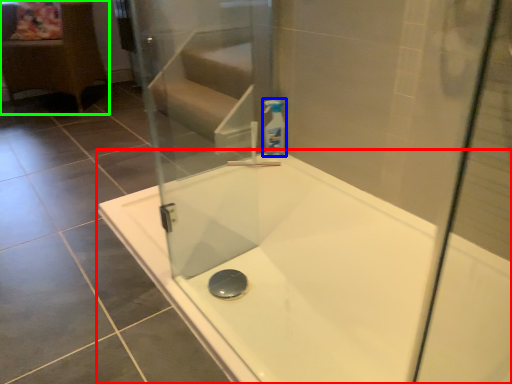
Question: Which is nearer to the bathtub (highlighted by a red box)? cleaning product (highlighted by a blue box) or furniture (highlighted by a green box).

Choices:
 (A) cleaning product
 (B) furniture

Answer: (A)